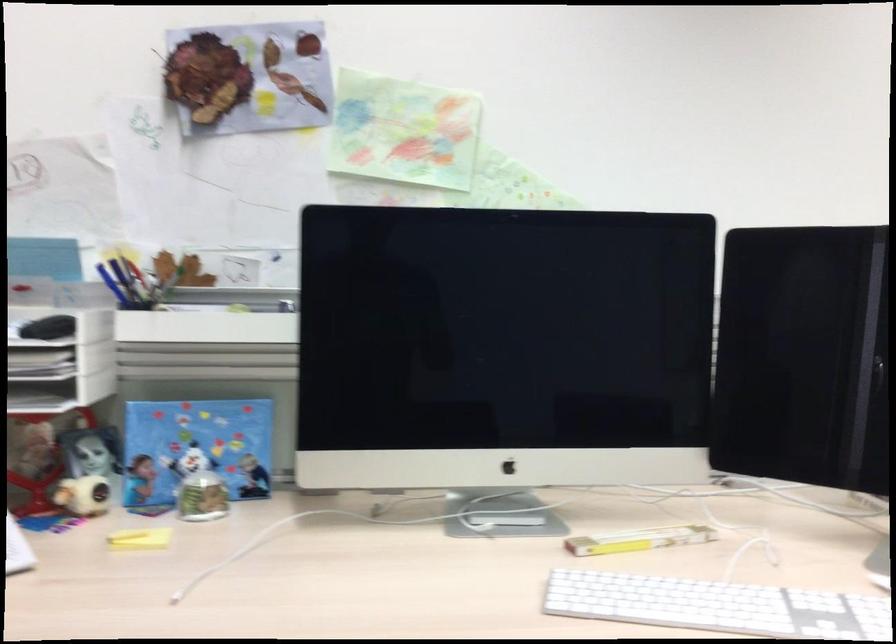
The location [113,285] corresponds to which object?

It corresponds to the blue pen in the image.